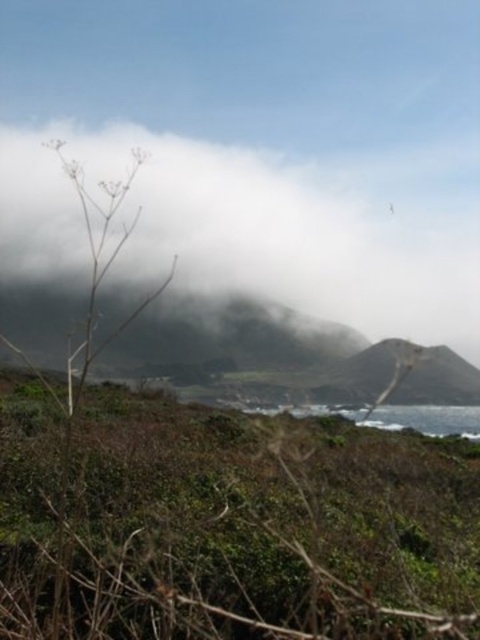
Measure the distance from green leafy shrubs at center to white fluffy cloud at upper center.

green leafy shrubs at center and white fluffy cloud at upper center are 38.74 meters apart.

What are the coordinates of `green leafy shrubs at center` in the screenshot? It's located at (229, 524).